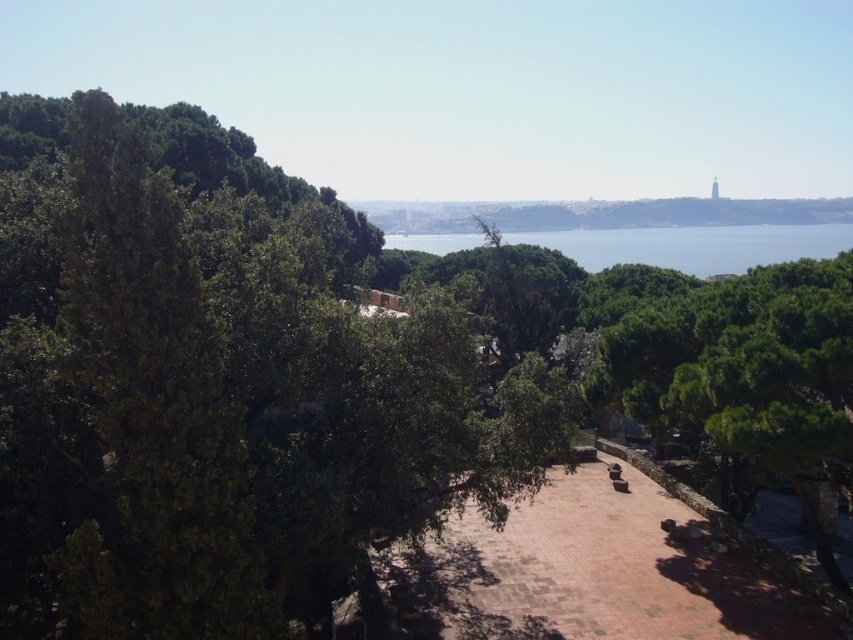
Question: Which is farther from the clear blue water at center?

Choices:
 (A) green leafy tree at center
 (B) green leafy hillside at center
 (C) brown stone path at center

Answer: (C)

Question: Which of the following is the closest to the observer?

Choices:
 (A) (376, 448)
 (B) (699, 202)
 (C) (531, 237)

Answer: (A)

Question: Among these objects, which one is nearest to the camera?

Choices:
 (A) green leafy hillside at center
 (B) clear blue water at center

Answer: (B)

Question: Does green leafy tree at center have a smaller size compared to brown stone path at center?

Choices:
 (A) yes
 (B) no

Answer: (B)

Question: Can you confirm if brown stone path at center is thinner than green leafy hillside at center?

Choices:
 (A) no
 (B) yes

Answer: (B)

Question: Can you confirm if green leafy tree at center is bigger than brown stone path at center?

Choices:
 (A) no
 (B) yes

Answer: (B)